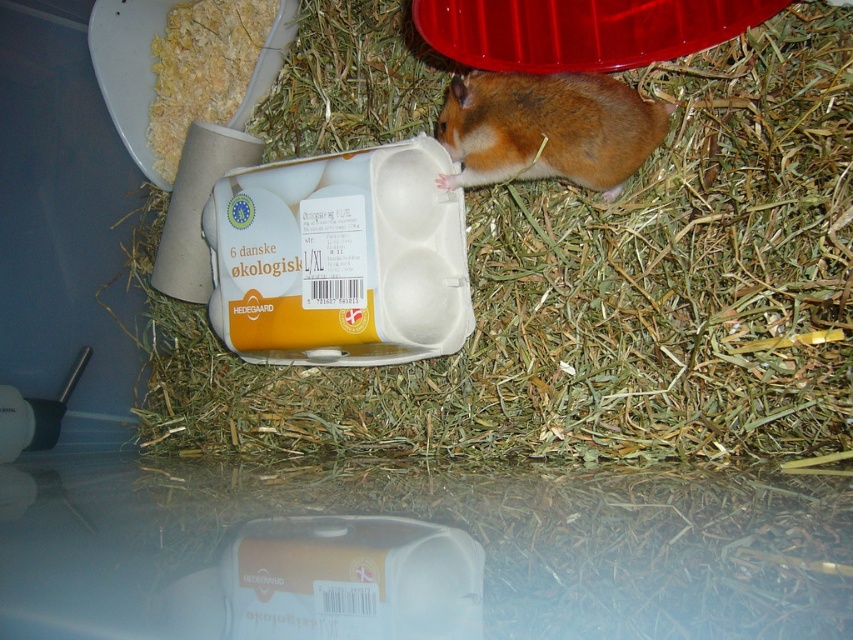
Is green straw at center wider than brown furry hamster at upper right?

Indeed, green straw at center has a greater width compared to brown furry hamster at upper right.

The image size is (853, 640). Find the location of `green straw at center`. green straw at center is located at coordinates (596, 300).